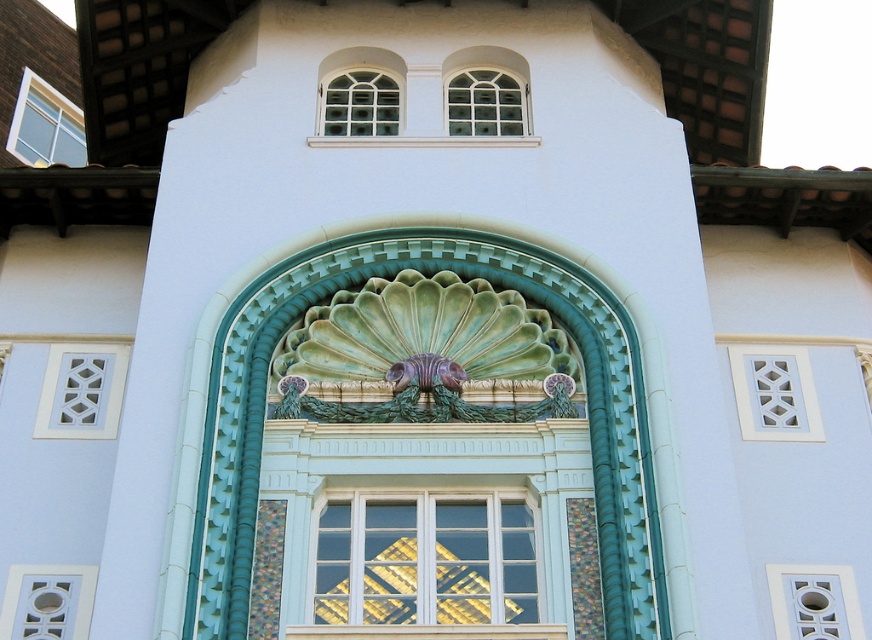
You are an architect analyzing the building facade. You notice the green ceramic scallop shell at center and the white lattice at center. Which object is taller?

The green ceramic scallop shell at center is taller than the white lattice at center.

You are standing in front of the building and want to take a photo of the white lattice at center. Which part of the building should you focus on to capture it clearly?

You should focus on the area at point coordinates (774, 394) to capture the white lattice at center clearly.